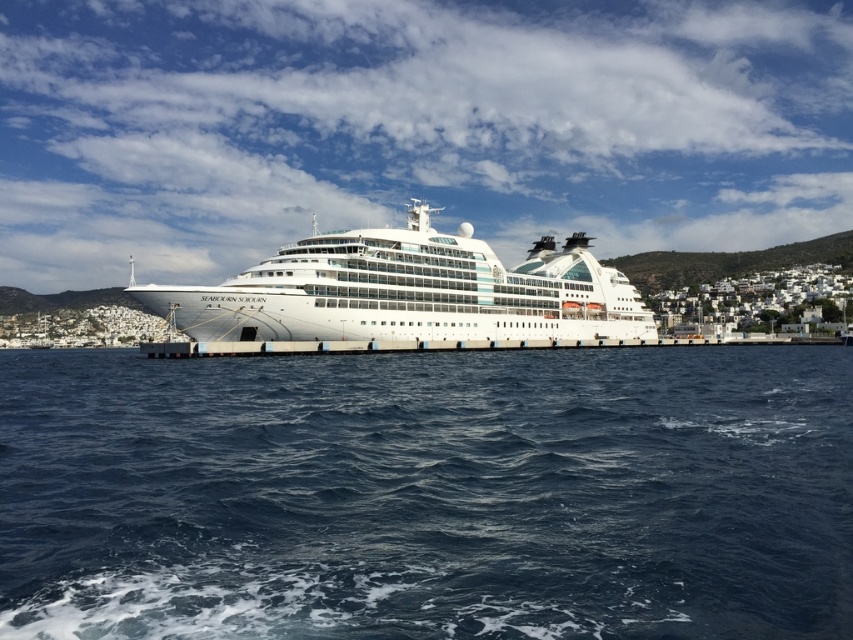
Question: Is dark blue water at center bigger than white glossy cruise ship at center?

Choices:
 (A) no
 (B) yes

Answer: (A)

Question: Which of the following is the farthest from the observer?

Choices:
 (A) coord(805,348)
 (B) coord(485,328)

Answer: (A)

Question: Considering the relative positions of dark blue water at center and white glossy cruise ship at center in the image provided, where is dark blue water at center located with respect to white glossy cruise ship at center?

Choices:
 (A) left
 (B) right

Answer: (B)

Question: Does dark blue water at center appear on the left side of white glossy cruise ship at center?

Choices:
 (A) no
 (B) yes

Answer: (A)

Question: Among these objects, which one is nearest to the camera?

Choices:
 (A) dark blue water at center
 (B) white glossy cruise ship at center

Answer: (A)